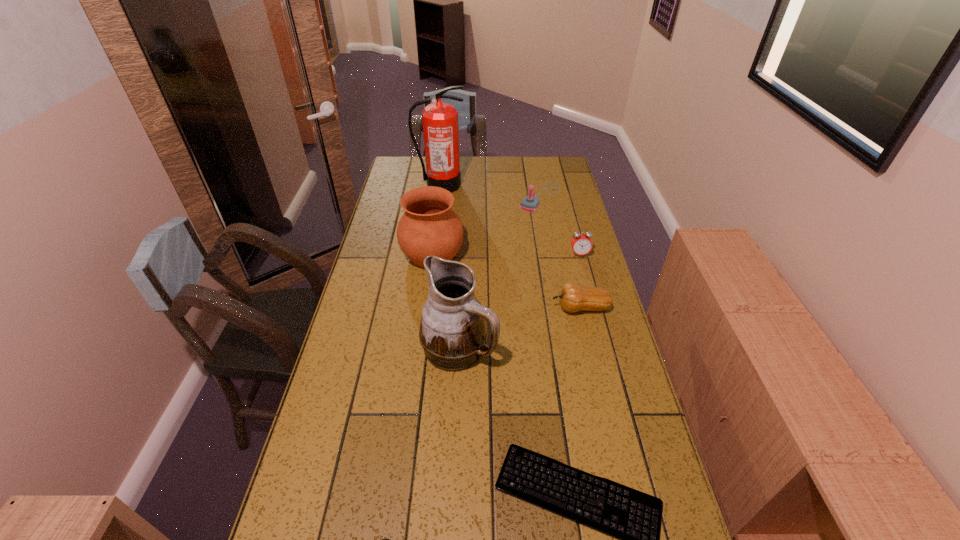
Locate an element on the screen. Image resolution: width=960 pixels, height=540 pixels. vacant space located 0.200m on the left of the joystick is located at coordinates (471, 197).

Locate an element on the screen. The width and height of the screenshot is (960, 540). free space located on the stem side of the gourd is located at coordinates tap(480, 308).

This screenshot has width=960, height=540. Identify the location of blank space located 0.100m on the stem side of the gourd. (520, 308).

Where is `vacant region located on the stem side of the gourd`? This screenshot has height=540, width=960. vacant region located on the stem side of the gourd is located at coordinates (529, 308).

Locate an element on the screen. The width and height of the screenshot is (960, 540). free space located 0.240m on the front-facing side of the alarm clock is located at coordinates (593, 306).

You are a GUI agent. You are given a task and a screenshot of the screen. Output one action in this format:
    pyautogui.click(x=<x>, y=<y>)
    Task: Click on the object present at the far edge
    The width and height of the screenshot is (960, 540).
    Given the screenshot: What is the action you would take?
    pyautogui.click(x=440, y=120)

The height and width of the screenshot is (540, 960). In order to click on fire extinguisher present at the left edge in this screenshot , I will do `click(440, 120)`.

Locate an element on the screen. The image size is (960, 540). pottery present at the left edge is located at coordinates (429, 226).

Where is `joystick located in the right edge section of the desktop`? joystick located in the right edge section of the desktop is located at coordinates (530, 203).

The width and height of the screenshot is (960, 540). Identify the location of gourd present at the right edge. (573, 297).